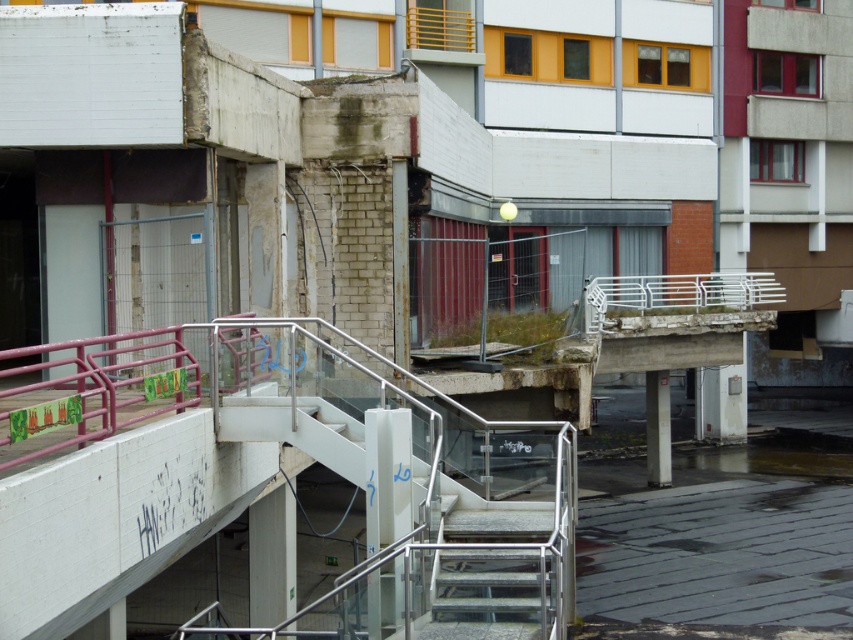
Can you confirm if metallic pink railing at center is positioned to the right of metallic gray stairs at center?

In fact, metallic pink railing at center is to the left of metallic gray stairs at center.

Between point (378, 433) and point (514, 609), which one is positioned in front?

Point (514, 609) is in front.

You are a GUI agent. You are given a task and a screenshot of the screen. Output one action in this format:
    pyautogui.click(x=<x>, y=<y>)
    Task: Click on the metallic pink railing at center
    
    Given the screenshot: What is the action you would take?
    pyautogui.click(x=328, y=467)